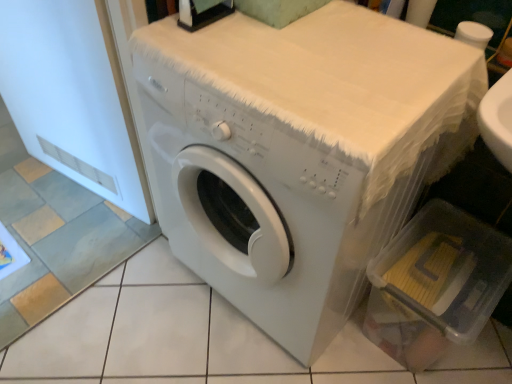
Where is `white matte screen door at left`? The width and height of the screenshot is (512, 384). white matte screen door at left is located at coordinates (72, 97).

Locate an element on the screen. The image size is (512, 384). white matte washing machine at center is located at coordinates (298, 152).

From a real-world perspective, which object rests below the other?

white matte washing machine at center.

From the image's perspective, between white matte screen door at left and white matte washing machine at center, which one is located above?

From the image's view, white matte screen door at left is above.

In the scene shown: Is the surface of white matte screen door at left in direct contact with white matte washing machine at center?

No.

Based on the photo, does white matte screen door at left have a smaller size compared to white matte washing machine at center?

Yes, white matte screen door at left is smaller than white matte washing machine at center.

Is white matte screen door at left to the left or to the right of clear plastic container at lower right in the image?

white matte screen door at left is to the left of clear plastic container at lower right.

Can we say white matte screen door at left lies outside clear plastic container at lower right?

Yes, white matte screen door at left is outside of clear plastic container at lower right.

Is the surface of white matte screen door at left in direct contact with clear plastic container at lower right?

white matte screen door at left is not next to clear plastic container at lower right, and they're not touching.

From the image's perspective, is white matte screen door at left above clear plastic container at lower right?

Yes, from the image's perspective, white matte screen door at left is over clear plastic container at lower right.

Is clear plastic container at lower right placed right next to white matte washing machine at center?

clear plastic container at lower right and white matte washing machine at center are clearly separated.

Is clear plastic container at lower right in front of or behind white matte washing machine at center in the image?

clear plastic container at lower right is positioned farther from the viewer than white matte washing machine at center.

From the image's perspective, does clear plastic container at lower right appear lower than white matte washing machine at center?

Yes.

Measure the distance between white matte washing machine at center and white matte screen door at left.

white matte washing machine at center and white matte screen door at left are 20.99 inches apart from each other.

In terms of width, does white matte washing machine at center look wider or thinner when compared to white matte screen door at left?

Clearly, white matte washing machine at center has more width compared to white matte screen door at left.

From the image's perspective, is white matte washing machine at center on white matte screen door at left?

Actually, white matte washing machine at center appears below white matte screen door at left in the image.

Is white matte washing machine at center surrounding white matte screen door at left?

Definitely not — white matte screen door at left is not inside white matte washing machine at center.

Where is `dish washer behind the white matte washing machine at center`? dish washer behind the white matte washing machine at center is located at coordinates (436, 285).

From the picture: Is white matte washing machine at center at the left side of clear plastic container at lower right?

Indeed, white matte washing machine at center is positioned on the left side of clear plastic container at lower right.

Is white matte washing machine at center positioned with its back to clear plastic container at lower right?

That's not correct — white matte washing machine at center is not looking away from clear plastic container at lower right.

In the scene shown: Is the depth of clear plastic container at lower right greater than that of white matte screen door at left?

Yes, it is.

This screenshot has height=384, width=512. In order to click on screen door above the clear plastic container at lower right (from the image's perspective) in this screenshot , I will do `click(72, 97)`.

From the picture: Between clear plastic container at lower right and white matte screen door at left, which one has smaller width?

Thinner between the two is white matte screen door at left.

Based on their positions, is clear plastic container at lower right located to the left or right of white matte screen door at left?

Based on their positions, clear plastic container at lower right is located to the right of white matte screen door at left.

The width and height of the screenshot is (512, 384). Identify the location of screen door on the left of white matte washing machine at center. (72, 97).

The image size is (512, 384). In order to click on dish washer behind the white matte screen door at left in this screenshot , I will do `click(436, 285)`.

When comparing their distances from white matte washing machine at center, does white matte screen door at left or clear plastic container at lower right seem further?

white matte screen door at left is further to white matte washing machine at center.

When comparing their distances from clear plastic container at lower right, does white matte washing machine at center or white matte screen door at left seem closer?

white matte washing machine at center.

From the image, which object appears to be nearer to clear plastic container at lower right, white matte screen door at left or white matte washing machine at center?

Among the two, white matte washing machine at center is located nearer to clear plastic container at lower right.

Considering their positions, is clear plastic container at lower right positioned further to white matte washing machine at center than white matte screen door at left?

white matte screen door at left.

Estimate the real-world distances between objects in this image. Which object is closer to white matte screen door at left, white matte washing machine at center or clear plastic container at lower right?

The object closer to white matte screen door at left is white matte washing machine at center.

Looking at the image, which one is located closer to white matte screen door at left, clear plastic container at lower right or white matte washing machine at center?

white matte washing machine at center is closer to white matte screen door at left.

Find the location of `washing machine located between white matte screen door at left and clear plastic container at lower right in the left-right direction`. washing machine located between white matte screen door at left and clear plastic container at lower right in the left-right direction is located at coordinates (298, 152).